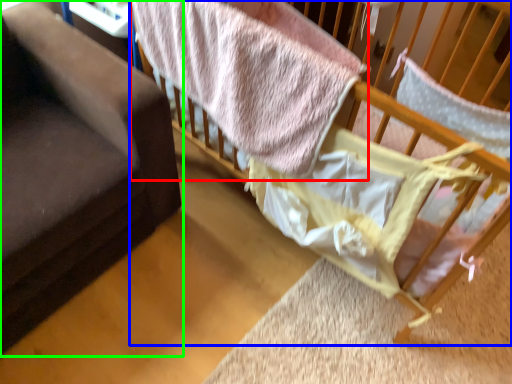
Question: Which object is positioned closest to bed (highlighted by a red box)? Select from infant bed (highlighted by a blue box) and furniture (highlighted by a green box).

Choices:
 (A) infant bed
 (B) furniture

Answer: (B)